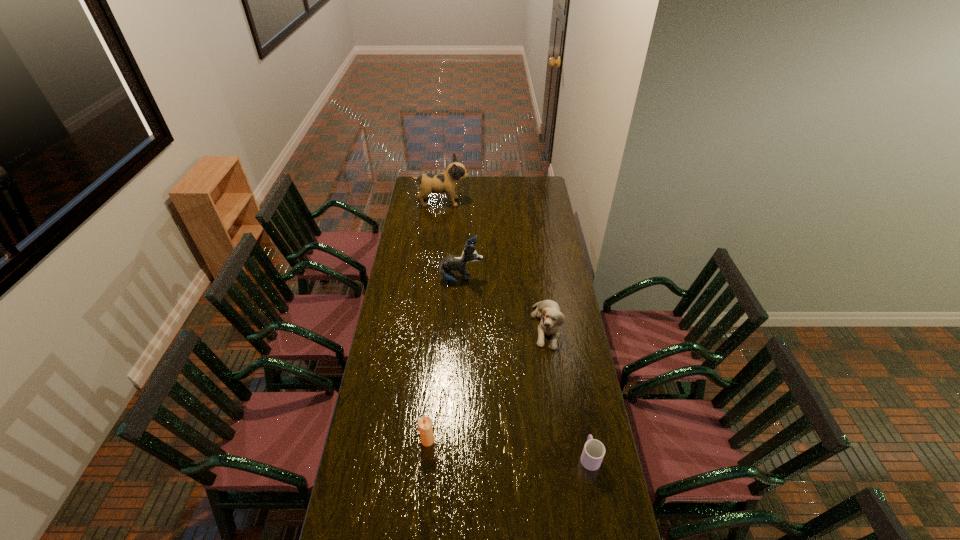
Find the location of `puppy object that ranks as the closest to the farthest puppy`. puppy object that ranks as the closest to the farthest puppy is located at coordinates (447, 266).

At what (x,y) coordinates should I click in order to perform the action: click on free region that satisfies the following two spatial constraints: 1. with the handle on the side of the shortest object; 2. at the face of the tallest puppy. Please return your answer as a coordinate pair (x, y). The height and width of the screenshot is (540, 960). Looking at the image, I should click on (542, 202).

Identify the location of free space that satisfies the following two spatial constraints: 1. on the front-facing side of the fourth shortest object; 2. with the handle on the side of the cup. (453, 456).

You are a GUI agent. You are given a task and a screenshot of the screen. Output one action in this format:
    pyautogui.click(x=<x>, y=<y>)
    Task: Click on the vacant region that satisfies the following two spatial constraints: 1. at the face of the farthest puppy; 2. with the handle on the side of the cup
    This screenshot has height=540, width=960.
    Given the screenshot: What is the action you would take?
    pyautogui.click(x=413, y=456)

This screenshot has width=960, height=540. What are the coordinates of `free space that satisfies the following two spatial constraints: 1. at the face of the candle; 2. on the left side of the farthest puppy` in the screenshot? It's located at (415, 440).

This screenshot has width=960, height=540. In order to click on vacant space that satisfies the following two spatial constraints: 1. on the front-facing side of the second farthest puppy; 2. with the handle on the side of the cup in this screenshot , I will do `click(453, 456)`.

Find the location of a particular element. The height and width of the screenshot is (540, 960). blank space that satisfies the following two spatial constraints: 1. at the face of the candle; 2. on the left side of the farthest object is located at coordinates (415, 440).

Image resolution: width=960 pixels, height=540 pixels. Find the location of `vacant point that satisfies the following two spatial constraints: 1. with the handle on the side of the shortest object; 2. at the face of the farthest puppy`. vacant point that satisfies the following two spatial constraints: 1. with the handle on the side of the shortest object; 2. at the face of the farthest puppy is located at coordinates (542, 202).